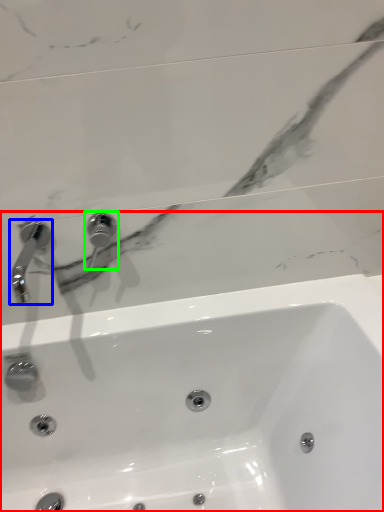
Question: Considering the real-world distances, which object is farthest from sink (highlighted by a red box)? tap (highlighted by a blue box) or tap (highlighted by a green box)?

Choices:
 (A) tap
 (B) tap

Answer: (A)